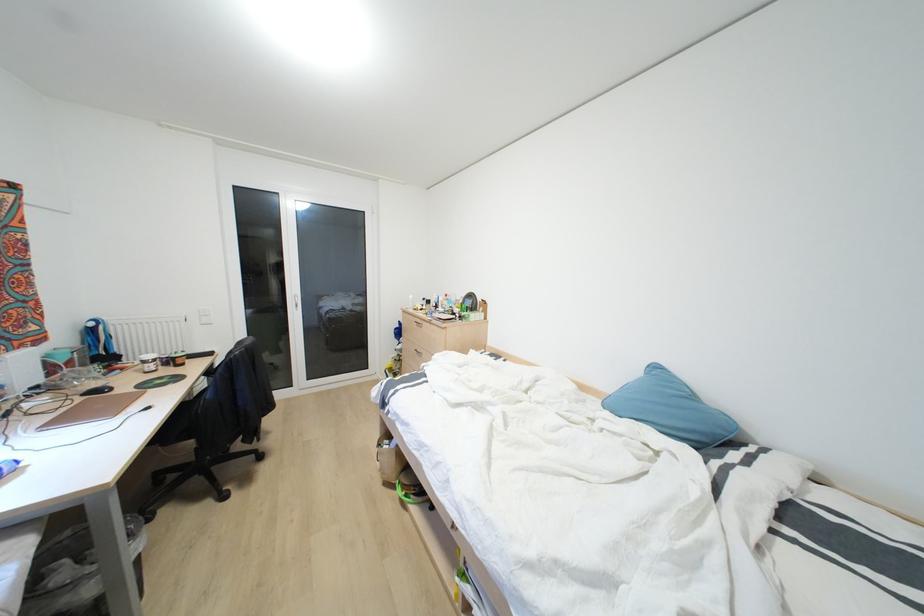
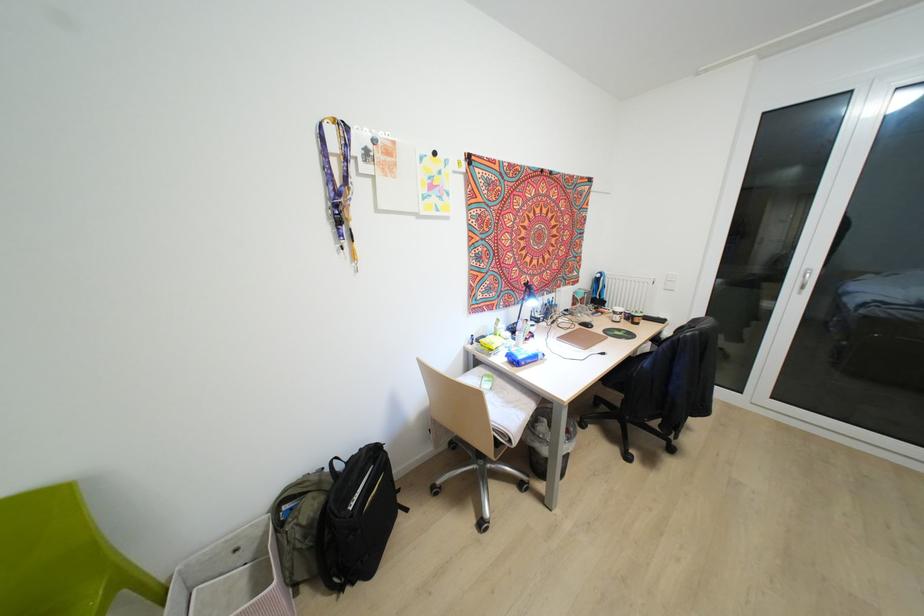
The point at (111, 389) is marked in the first image. Where is the corresponding point in the second image?

(591, 326)